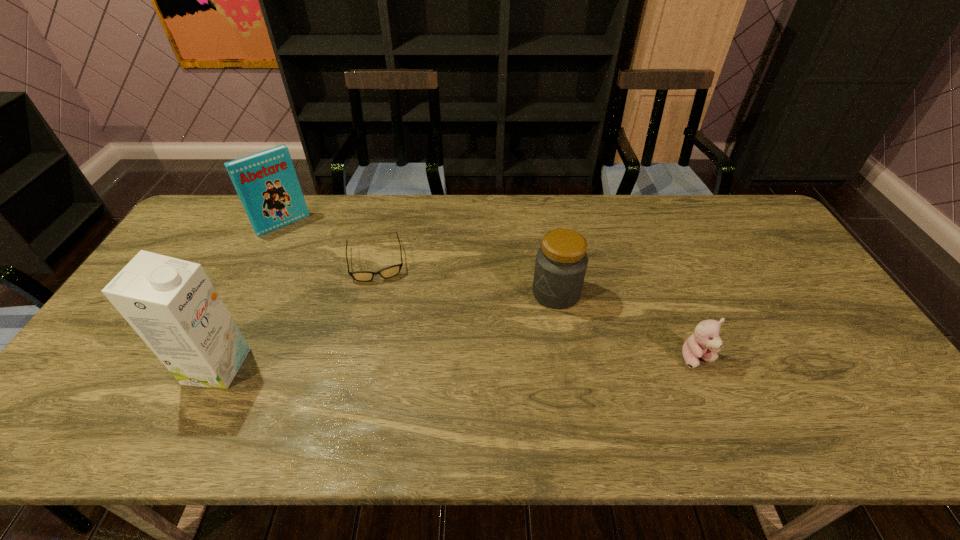
Where is `vacant area situated 0.270m on the surface of the jar near the warning symbol`? This screenshot has width=960, height=540. vacant area situated 0.270m on the surface of the jar near the warning symbol is located at coordinates (461, 353).

The height and width of the screenshot is (540, 960). I want to click on vacant region located 0.100m on the surface of the jar near the warning symbol, so click(x=512, y=321).

Find the location of a particular element. This screenshot has width=960, height=540. vacant space located 0.300m on the surface of the jar near the warning symbol is located at coordinates [451, 359].

Identify the location of free spot located on the front-facing side of the shortest object. Image resolution: width=960 pixels, height=540 pixels. (385, 345).

Locate an element on the screen. vacant region located 0.350m on the front-facing side of the shortest object is located at coordinates (390, 384).

Where is `free spot located on the front-facing side of the shortest object`? The image size is (960, 540). free spot located on the front-facing side of the shortest object is located at coordinates (385, 345).

Locate an element on the screen. This screenshot has width=960, height=540. free space located 0.330m on the front cover of the second tallest object is located at coordinates (340, 290).

Find the location of a particular element. Image resolution: width=960 pixels, height=540 pixels. vacant area situated on the front cover of the second tallest object is located at coordinates (335, 285).

The width and height of the screenshot is (960, 540). I want to click on free space located on the front cover of the second tallest object, so click(x=309, y=253).

In order to click on object that is at the far edge in this screenshot , I will do `click(266, 182)`.